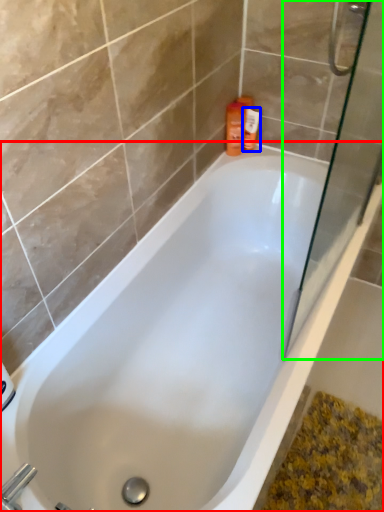
Question: Which object is positioned farthest from bathtub (highlighted by a red box)? Select from toiletry (highlighted by a blue box) and screen door (highlighted by a green box).

Choices:
 (A) toiletry
 (B) screen door

Answer: (A)